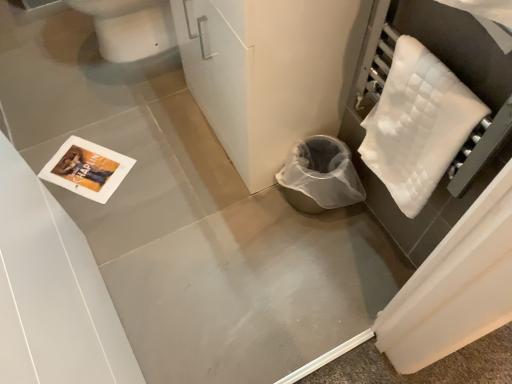
Question: Is white glossy toilet bowl at upper left inside or outside of white quilted towel at right?

Choices:
 (A) inside
 (B) outside

Answer: (B)

Question: From their relative heights in the image, would you say white glossy toilet bowl at upper left is taller or shorter than white quilted towel at right?

Choices:
 (A) short
 (B) tall

Answer: (B)

Question: Does point (159, 41) appear closer or farther from the camera than point (382, 114)?

Choices:
 (A) closer
 (B) farther

Answer: (B)

Question: In terms of width, does white quilted towel at right look wider or thinner when compared to white glossy toilet bowl at upper left?

Choices:
 (A) thin
 (B) wide

Answer: (A)

Question: From a real-world perspective, is white quilted towel at right physically located above or below white glossy toilet bowl at upper left?

Choices:
 (A) below
 (B) above

Answer: (B)

Question: Is white quilted towel at right situated inside white glossy toilet bowl at upper left or outside?

Choices:
 (A) outside
 (B) inside

Answer: (A)

Question: From the image's perspective, is white quilted towel at right above or below white glossy toilet bowl at upper left?

Choices:
 (A) below
 (B) above

Answer: (A)